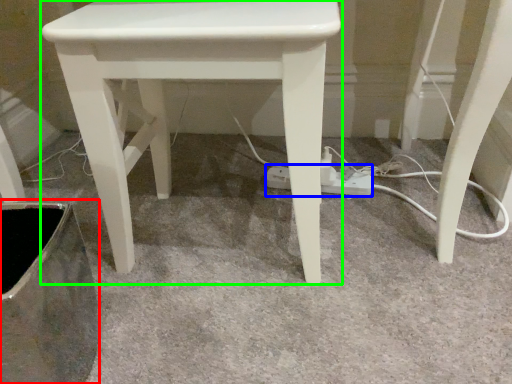
Question: Which object is positioned closest to swivel chair (highlighted by a red box)? Select from extension cord (highlighted by a blue box) and stool (highlighted by a green box).

Choices:
 (A) extension cord
 (B) stool

Answer: (B)